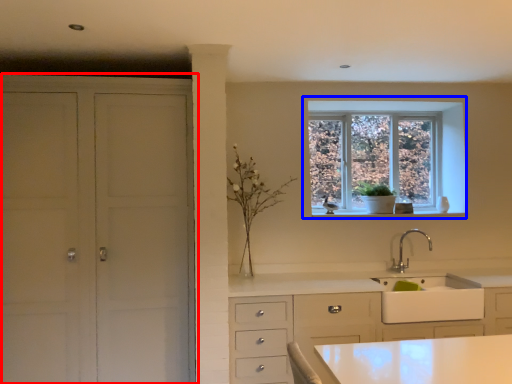
Question: Which of the following is the closest to the observer, cupboard (highlighted by a red box) or window (highlighted by a blue box)?

Choices:
 (A) cupboard
 (B) window

Answer: (A)